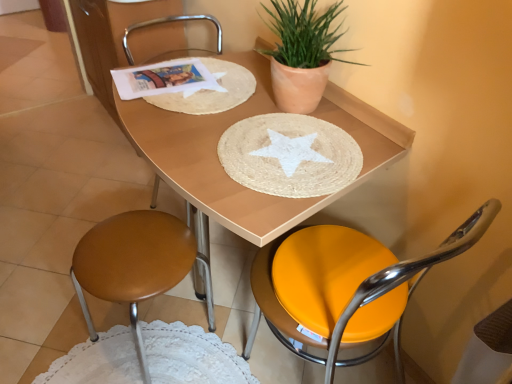
Where is `free point below wooden seat at lower left, the 3th chair in the right-to-left sequence (from a real-world perspective)`? free point below wooden seat at lower left, the 3th chair in the right-to-left sequence (from a real-world perspective) is located at coordinates (148, 345).